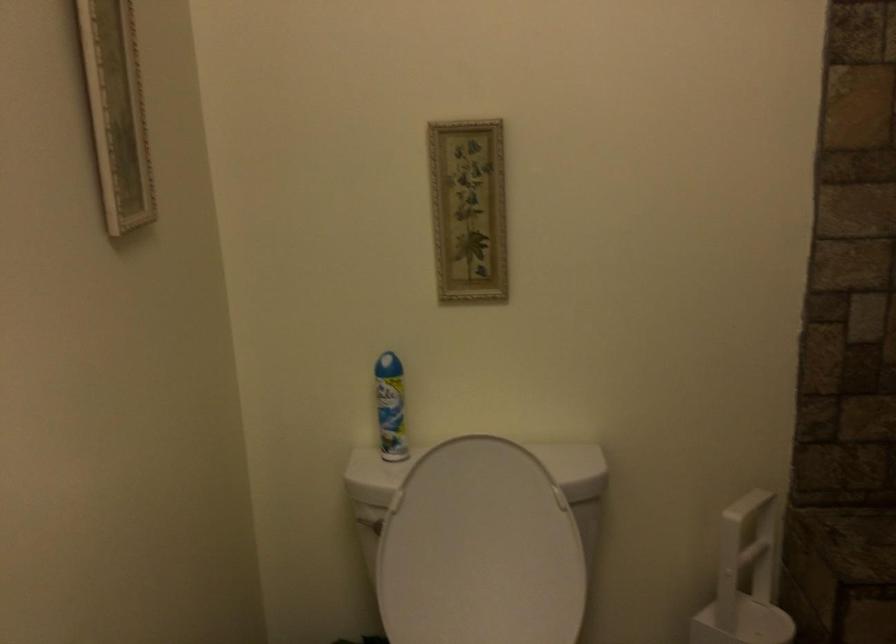
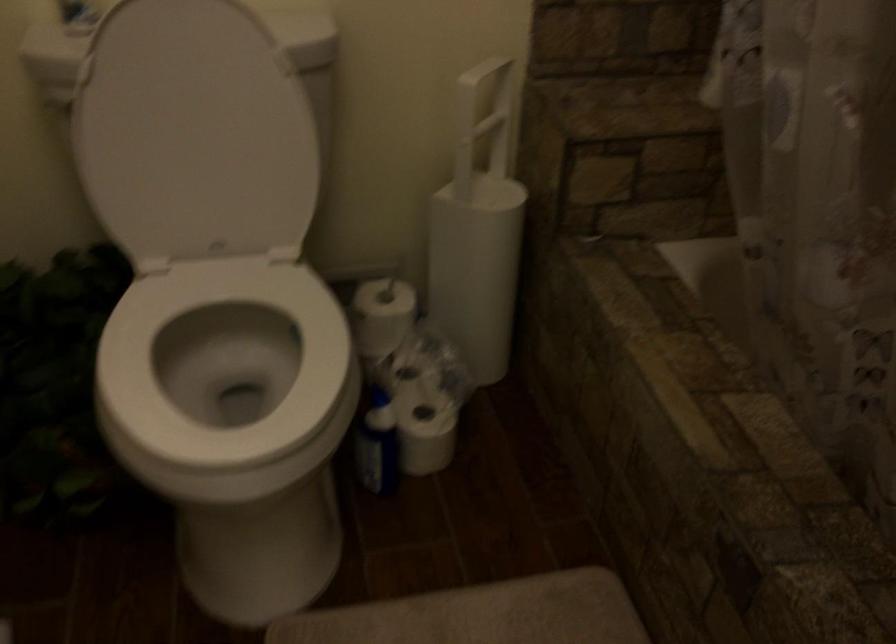
Where in the second image is the point corresponding to the point at 466,558 from the first image?

(194, 134)